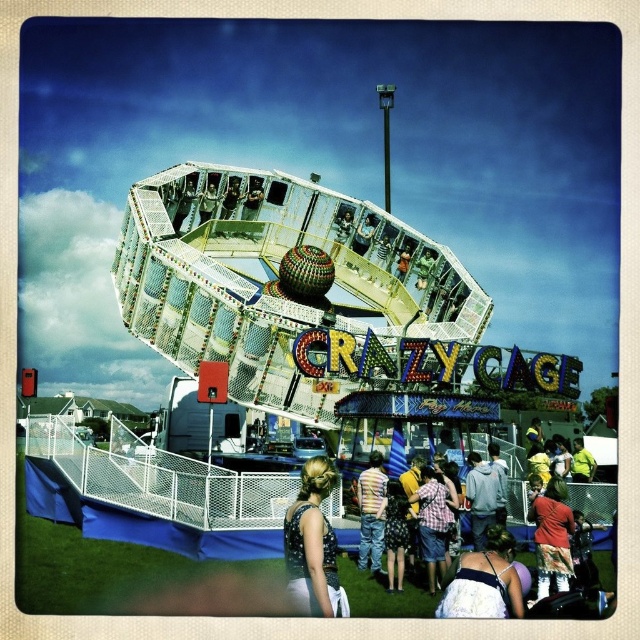
This screenshot has height=640, width=640. What do you see at coordinates (312, 545) in the screenshot? I see `dark blue textured dress at center` at bounding box center [312, 545].

Is dark blue textured dress at center smaller than striped shirt at center?

Actually, dark blue textured dress at center might be larger than striped shirt at center.

Between point (348, 614) and point (380, 548), which one is positioned behind?

The point (380, 548) is more distant.

Identify the location of dark blue textured dress at center. coord(312,545).

Does point (364, 522) come in front of point (497, 506)?

That is True.

Identify the location of striped shirt at center. (371, 513).

Is metallic shiny cage at center smaller than floral-patterned dress at center?

Incorrect, metallic shiny cage at center is not smaller in size than floral-patterned dress at center.

Looking at this image, who is positioned more to the left, metallic shiny cage at center or floral-patterned dress at center?

metallic shiny cage at center is more to the left.

Does point (259, 300) come closer to viewer compared to point (541, 513)?

No, it is not.

The width and height of the screenshot is (640, 640). What are the coordinates of `metallic shiny cage at center` in the screenshot? It's located at pos(275,278).